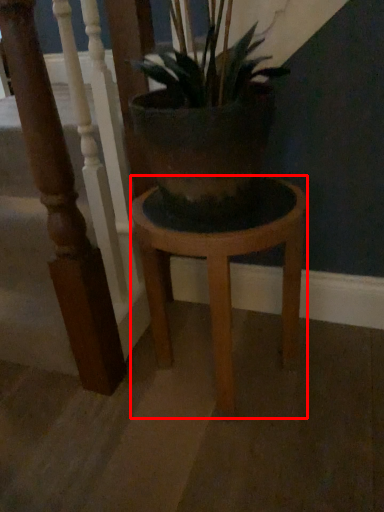
Question: Where is stool (annotated by the red box) located in relation to rail in the image?

Choices:
 (A) right
 (B) left

Answer: (A)